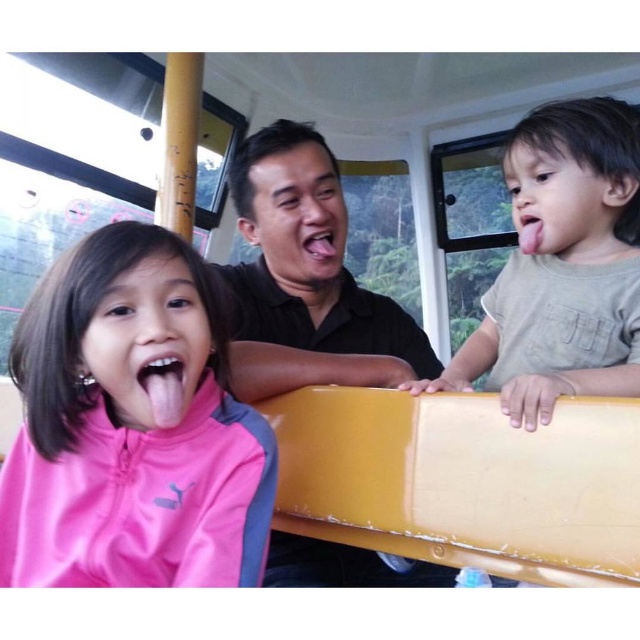
Question: Does light brown cotton shirt at right appear on the left side of pink matte tongue at center?

Choices:
 (A) no
 (B) yes

Answer: (A)

Question: Is pink fabric jacket at left below pink matte tongue at center?

Choices:
 (A) yes
 (B) no

Answer: (A)

Question: Which of the following is the farthest from the observer?

Choices:
 (A) pyautogui.click(x=317, y=253)
 (B) pyautogui.click(x=1, y=557)
 (C) pyautogui.click(x=532, y=371)
 (D) pyautogui.click(x=337, y=192)

Answer: (D)

Question: Does pink matte tongue at center have a lesser width compared to pink matte tongue at right?

Choices:
 (A) yes
 (B) no

Answer: (B)

Question: Which object appears farthest from the camera in this image?

Choices:
 (A) black matte shirt at center
 (B) pink matte tongue at right
 (C) light brown cotton shirt at right

Answer: (B)

Question: Which of the following is the farthest from the observer?

Choices:
 (A) black matte shirt at center
 (B) pink fabric jacket at left

Answer: (A)